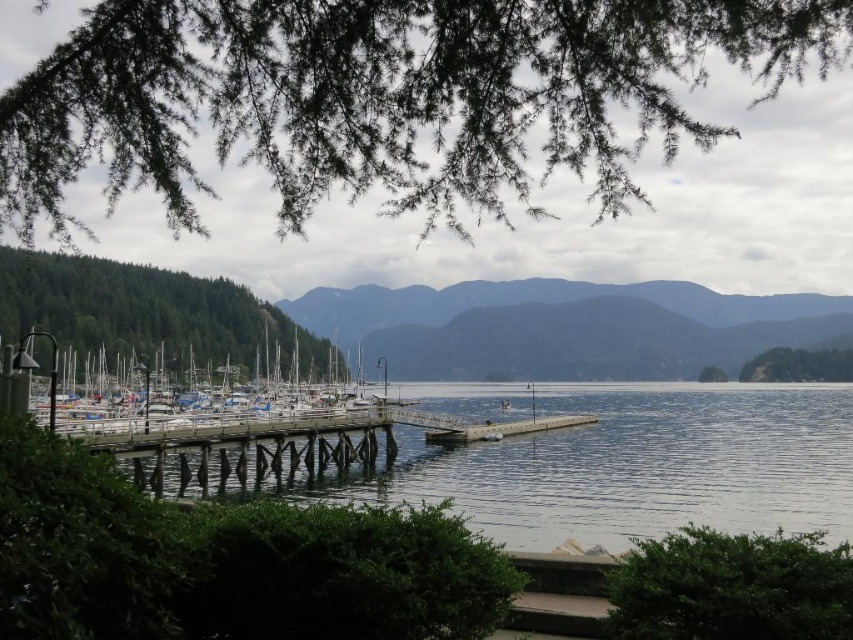
Question: Which point is closer to the camera?

Choices:
 (A) (700, 376)
 (B) (209, 400)

Answer: (B)

Question: Observing the image, what is the correct spatial positioning of green leafy bush at lower right in reference to green matte tree at center?

Choices:
 (A) left
 (B) right

Answer: (A)

Question: Is green matte mountains at center positioned behind green leafy bush at lower right?

Choices:
 (A) no
 (B) yes

Answer: (B)

Question: Is clear water at center positioned in front of green leafy bush at lower right?

Choices:
 (A) yes
 (B) no

Answer: (B)

Question: Among these objects, which one is nearest to the camera?

Choices:
 (A) green leafy bush at lower right
 (B) green matte tree at left

Answer: (A)

Question: Which point is farther to the camera?

Choices:
 (A) green needle-like branches at upper left
 (B) green leafy bush at lower right
 (C) green matte tree at left
 (D) white matte boats at center

Answer: (C)